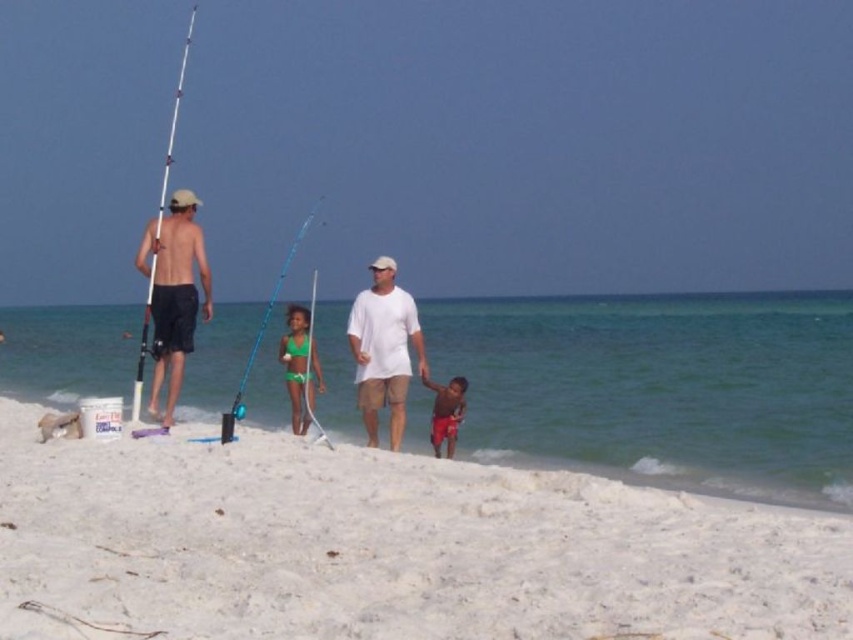
Question: Which point is farther to the camera?

Choices:
 (A) (439, 416)
 (B) (250, 368)

Answer: (B)

Question: Among these points, which one is nearest to the camera?

Choices:
 (A) (192, 289)
 (B) (309, 305)
 (C) (393, 442)

Answer: (A)

Question: Is telescopic fiberglass fishing pole at left above bright red shorts at lower right?

Choices:
 (A) yes
 (B) no

Answer: (A)

Question: Among these objects, which one is farthest from the camera?

Choices:
 (A) white sandy beach at lower center
 (B) green swimsuit at center

Answer: (B)

Question: Can you confirm if white cotton shirt at center is positioned to the right of blue fiberglass fishing pole at center?

Choices:
 (A) no
 (B) yes

Answer: (B)

Question: Can you confirm if white cotton shirt at center is positioned above teal fiberglass fishing pole at center?

Choices:
 (A) yes
 (B) no

Answer: (B)